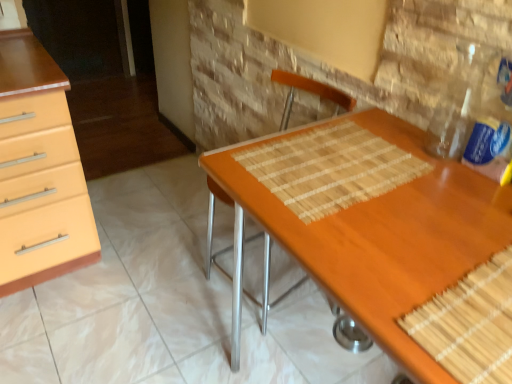
Locate an element on the screen. vacant space underneath orange woven fabric chair at center (from a real-world perspective) is located at coordinates (244, 292).